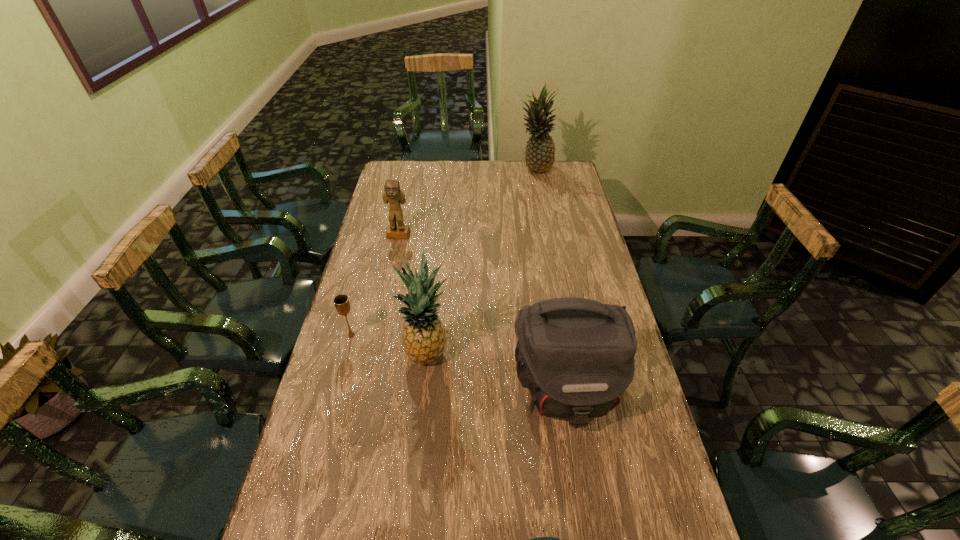
The height and width of the screenshot is (540, 960). Identify the location of the farthest object. (539, 156).

I want to click on the farther pineapple, so click(x=539, y=156).

Image resolution: width=960 pixels, height=540 pixels. I want to click on the left pineapple, so click(424, 337).

Image resolution: width=960 pixels, height=540 pixels. What are the coordinates of `the nearer pineapple` in the screenshot? It's located at (424, 337).

Where is `shoulder bag`? Image resolution: width=960 pixels, height=540 pixels. shoulder bag is located at coordinates (576, 355).

What are the coordinates of `the fifth object from right to left` in the screenshot? It's located at (392, 193).

At what (x,y) coordinates should I click in order to perform the action: click on the third shortest object. Please return your answer as a coordinate pair (x, y). The width and height of the screenshot is (960, 540). Looking at the image, I should click on (392, 193).

Where is `the leftmost object`? the leftmost object is located at coordinates (342, 304).

I want to click on chalice, so [x=342, y=304].

Image resolution: width=960 pixels, height=540 pixels. In order to click on vacant space located 0.090m on the right of the farther pineapple in this screenshot , I will do `click(572, 169)`.